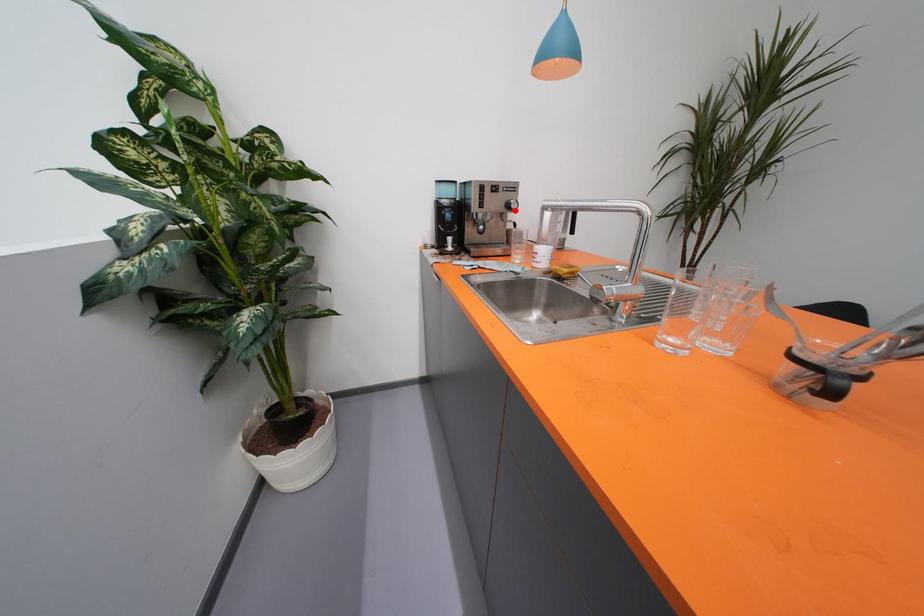
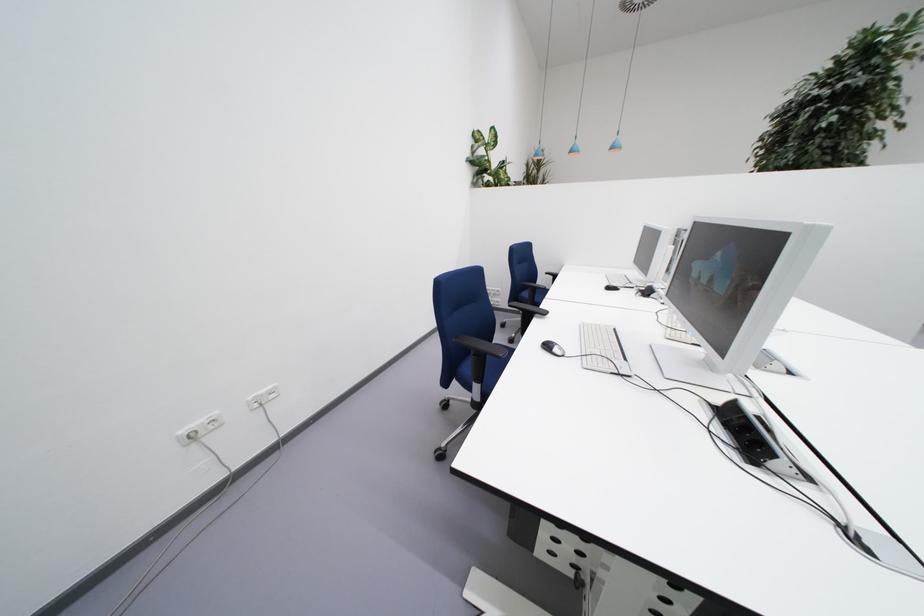
Question: I am providing you with two images of the same scene from different viewpoints. A red point is marked on the first image. At the location where the point appears in image 1, is it still visible in image 2?

Choices:
 (A) Yes
 (B) No

Answer: (B)